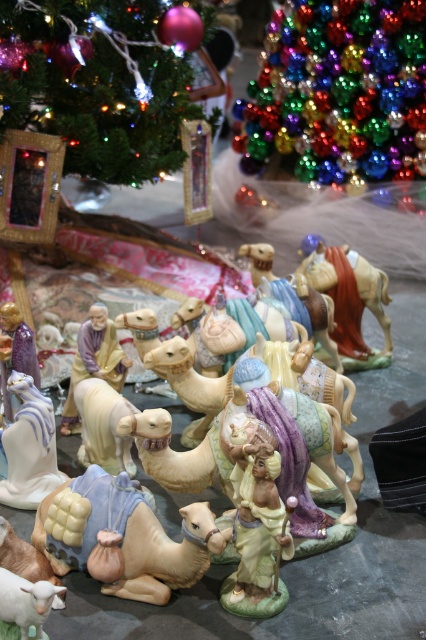
You are a child who wants to touch the white glossy figurine at center but first needs to move the porcelain camel at center. Which object should you move first to reach the figurine?

The porcelain camel at center is closer to you than the white glossy figurine at center, so you should move the porcelain camel at center first to reach the white glossy figurine at center.

You are setting up a nativity scene and want to place the porcelain camel at center and the white glossy figurine at center on a shelf. The shelf has a minimum spacing requirement of 8 inches between items for safety. Can you place them on the shelf without violating the spacing rule?

The distance between the porcelain camel at center and the white glossy figurine at center is 9.11 inches, which exceeds the 8 inches requirement. Therefore, they can be placed on the shelf without violating the spacing rule.

You are decorating a Christmas tree and have the multicolored glass ornaments at upper center and the matte beige camel at center. Which ornament is larger?

The multicolored glass ornaments at upper center is bigger than the matte beige camel at center.